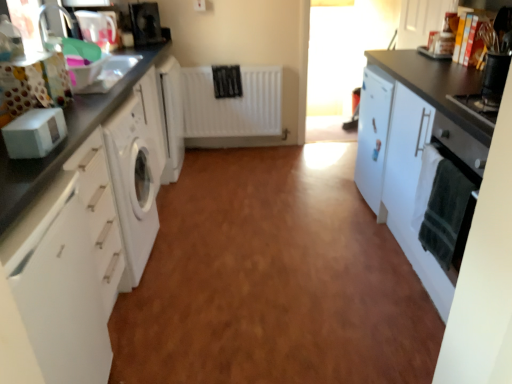
Describe the element at coordinates (59, 287) in the screenshot. This screenshot has height=384, width=512. I see `white matte cabinet at left, the 2th cabinetry from the right` at that location.

Locate an element on the screen. white glossy cabinet at left, positioned as the 1th cabinetry in left-to-right order is located at coordinates (57, 163).

Measure the distance between green towel at right and camera.

The distance of green towel at right from camera is 4.44 feet.

This screenshot has height=384, width=512. In order to click on white glossy jug at upper left, which is the 4th appliance in right-to-left order in this screenshot , I will do `click(97, 28)`.

How much space does white matte cabinet at right, which ranks as the first cabinetry in right-to-left order, occupy horizontally?

The width of white matte cabinet at right, which ranks as the first cabinetry in right-to-left order, is 64.74 centimeters.

This screenshot has height=384, width=512. Describe the element at coordinates (415, 145) in the screenshot. I see `white matte cabinet at right, which ranks as the first cabinetry in right-to-left order` at that location.

What do you see at coordinates (232, 104) in the screenshot?
I see `white matte radiator at center` at bounding box center [232, 104].

Find the location of a particular element. The image size is (512, 384). white matte radiator at center is located at coordinates (232, 104).

The image size is (512, 384). What are the coordinates of `white matte cabinet at left, the 2th cabinetry from the right` in the screenshot? It's located at (59, 287).

From the image's perspective, is white glossy cabinet at left, positioned as the 1th cabinetry in left-to-right order, beneath white matte cabinet at right, marked as the third cabinetry in a left-to-right arrangement?

Correct, white glossy cabinet at left, positioned as the 1th cabinetry in left-to-right order, appears lower than white matte cabinet at right, marked as the third cabinetry in a left-to-right arrangement, in the image.

Which of these two, white glossy cabinet at left, the third cabinetry positioned from the right, or white matte cabinet at right, which ranks as the first cabinetry in right-to-left order, stands shorter?

Standing shorter between the two is white glossy cabinet at left, the third cabinetry positioned from the right.

From a real-world perspective, does white glossy cabinet at left, positioned as the 1th cabinetry in left-to-right order, sit lower than white matte cabinet at right, which ranks as the first cabinetry in right-to-left order?

Actually, white glossy cabinet at left, positioned as the 1th cabinetry in left-to-right order, is physically above white matte cabinet at right, which ranks as the first cabinetry in right-to-left order, in the real world.

Would you say white glossy cabinet at left, positioned as the 1th cabinetry in left-to-right order, is inside or outside white matte cabinet at right, which ranks as the first cabinetry in right-to-left order?

The correct answer is: outside.

Would you say white matte radiator at center contains white glossy washing machine at left?

Actually, white glossy washing machine at left is outside white matte radiator at center.

Based on their positions, is white matte radiator at center located to the left or right of white glossy washing machine at left?

Clearly, white matte radiator at center is on the left of white glossy washing machine at left in the image.

From the image's perspective, would you say white matte radiator at center is positioned over white glossy washing machine at left?

Indeed, from the image's perspective, white matte radiator at center is shown above white glossy washing machine at left.

Considering the relative sizes of white matte radiator at center and white glossy washing machine at left in the image provided, is white matte radiator at center bigger than white glossy washing machine at left?

Actually, white matte radiator at center might be smaller than white glossy washing machine at left.

Considering the positions of point (505, 69) and point (430, 114), is point (505, 69) closer or farther from the camera than point (430, 114)?

Point (505, 69).

From the image's perspective, would you say black plastic container at upper right, acting as the third appliance starting from the back, is positioned over white matte cabinet at right, marked as the third cabinetry in a left-to-right arrangement?

Indeed, from the image's perspective, black plastic container at upper right, acting as the third appliance starting from the back, is shown above white matte cabinet at right, marked as the third cabinetry in a left-to-right arrangement.

Is black plastic container at upper right, acting as the third appliance starting from the back, located outside white matte cabinet at right, which ranks as the first cabinetry in right-to-left order?

Absolutely, black plastic container at upper right, acting as the third appliance starting from the back, is external to white matte cabinet at right, which ranks as the first cabinetry in right-to-left order.

Is black plastic container at upper right, positioned as the 1th appliance in right-to-left order, to the left or to the right of white matte cabinet at right, marked as the third cabinetry in a left-to-right arrangement, in the image?

black plastic container at upper right, positioned as the 1th appliance in right-to-left order, is positioned on white matte cabinet at right, marked as the third cabinetry in a left-to-right arrangement,'s right side.

From the image's perspective, between white matte microwave at left, marked as the 4th appliance in a top-to-bottom arrangement, and white glossy jug at upper left, which appears as the 2th appliance when viewed from the top, which one is located above?

white glossy jug at upper left, which appears as the 2th appliance when viewed from the top, from the image's perspective.

Does point (27, 148) lie behind point (94, 34)?

No.

Is white matte microwave at left, the 3th appliance positioned from the left, completely or partially outside of white glossy jug at upper left, the second appliance in the back-to-front sequence?

That's correct, white matte microwave at left, the 3th appliance positioned from the left, is outside of white glossy jug at upper left, the second appliance in the back-to-front sequence.

Is there a large distance between white matte microwave at left, marked as the 4th appliance in a top-to-bottom arrangement, and white glossy jug at upper left, the second appliance in the back-to-front sequence?

Yes, white matte microwave at left, marked as the 4th appliance in a top-to-bottom arrangement, and white glossy jug at upper left, the second appliance in the back-to-front sequence, are quite far apart.

Measure the distance from white matte radiator at center to black plastic container at upper right, positioned as the 1th appliance in right-to-left order.

white matte radiator at center and black plastic container at upper right, positioned as the 1th appliance in right-to-left order, are 6.83 feet apart.

Is white matte radiator at center in front of or behind black plastic container at upper right, the 3th appliance from the top, in the image?

Visually, white matte radiator at center is located behind black plastic container at upper right, the 3th appliance from the top.

Who is bigger, white matte radiator at center or black plastic container at upper right, which appears as the 4th appliance when viewed from the left?

white matte radiator at center is bigger.

Consider the image. From a real-world perspective, is white matte radiator at center above or below black plastic container at upper right, which appears as the 4th appliance when viewed from the left?

From a real-world perspective, white matte radiator at center is physically below black plastic container at upper right, which appears as the 4th appliance when viewed from the left.

Is white glossy jug at upper left, which is the 4th appliance in right-to-left order, at the left side of black plastic container at upper right, which is counted as the 2th appliance, starting from the front?

Indeed, white glossy jug at upper left, which is the 4th appliance in right-to-left order, is positioned on the left side of black plastic container at upper right, which is counted as the 2th appliance, starting from the front.

Would you say white glossy jug at upper left, the second appliance in the back-to-front sequence, is outside black plastic container at upper right, which is counted as the 2th appliance, starting from the front?

white glossy jug at upper left, the second appliance in the back-to-front sequence, lies outside black plastic container at upper right, which is counted as the 2th appliance, starting from the front,'s area.

Are white glossy jug at upper left, which appears as the 2th appliance when viewed from the top, and black plastic container at upper right, which is counted as the 2th appliance, starting from the front, far apart?

Absolutely, white glossy jug at upper left, which appears as the 2th appliance when viewed from the top, is distant from black plastic container at upper right, which is counted as the 2th appliance, starting from the front.

Which is behind, white matte radiator at center or black glossy fan at upper center, the first appliance positioned from the top?

white matte radiator at center is behind.

Which of these two, white matte radiator at center or black glossy fan at upper center, arranged as the fourth appliance when viewed from the front, stands taller?

white matte radiator at center.

From a real-world perspective, is white matte radiator at center above or below black glossy fan at upper center, placed as the 2th appliance when sorted from left to right?

white matte radiator at center is below black glossy fan at upper center, placed as the 2th appliance when sorted from left to right.

I want to click on the 1st cabinetry positioned below the white matte cabinet at right, which ranks as the first cabinetry in right-to-left order (from the image's perspective), so click(57, 163).

At what (x,y) coordinates should I click in order to perform the action: click on radiator on the left of white glossy washing machine at left. Please return your answer as a coordinate pair (x, y). Looking at the image, I should click on (232, 104).

Considering their positions, is white matte cabinet at left, the 2th cabinetry from the right, positioned closer to white glossy jug at upper left, which appears as the 2th appliance when viewed from the top, than green towel at right?

white matte cabinet at left, the 2th cabinetry from the right, lies closer to white glossy jug at upper left, which appears as the 2th appliance when viewed from the top, than the other object.

Estimate the real-world distances between objects in this image. Which object is closer to white glossy washing machine at left, black glossy fan at upper center, placed as the 2th appliance when sorted from left to right, or white matte cabinet at left, the 2th cabinetry from the right?

The object closer to white glossy washing machine at left is white matte cabinet at left, the 2th cabinetry from the right.

Based on their spatial positions, is white matte radiator at center or white matte cabinet at right, which ranks as the first cabinetry in right-to-left order, further from black glossy fan at upper center, acting as the 1th appliance starting from the back?

white matte cabinet at right, which ranks as the first cabinetry in right-to-left order, is further to black glossy fan at upper center, acting as the 1th appliance starting from the back.

From the image, which object appears to be nearer to white matte radiator at center, green towel at right or white matte microwave at left, the second appliance from the right?

green towel at right is positioned closer to the anchor white matte radiator at center.

Which object lies further to the anchor point white matte radiator at center, white glossy washing machine at left or black glossy fan at upper center, placed as the 2th appliance when sorted from left to right?

Among the two, white glossy washing machine at left is located further to white matte radiator at center.

Which object lies further to the anchor point white glossy jug at upper left, which is the 4th appliance in right-to-left order, white glossy cabinet at left, the third cabinetry positioned from the right, or green towel at right?

green towel at right is further to white glossy jug at upper left, which is the 4th appliance in right-to-left order.

In the scene shown: Estimate the real-world distances between objects in this image. Which object is closer to black plastic container at upper right, which is counted as the 2th appliance, starting from the front, white glossy washing machine at left or white glossy cabinet at left, positioned as the 1th cabinetry in left-to-right order?

Among the two, white glossy washing machine at left is located nearer to black plastic container at upper right, which is counted as the 2th appliance, starting from the front.

In the scene shown: Looking at the image, which one is located closer to white matte radiator at center, white matte microwave at left, the second appliance from the right, or white glossy jug at upper left, which is the 4th appliance in right-to-left order?

white glossy jug at upper left, which is the 4th appliance in right-to-left order, lies closer to white matte radiator at center than the other object.

The image size is (512, 384). Find the location of `plain between white glossy cabinet at left, the third cabinetry positioned from the right, and black glossy fan at upper center, acting as the 1th appliance starting from the back, along the z-axis`. plain between white glossy cabinet at left, the third cabinetry positioned from the right, and black glossy fan at upper center, acting as the 1th appliance starting from the back, along the z-axis is located at coordinates (272, 281).

Identify the location of appliance between white matte cabinet at left, the 2th cabinetry from the right, and white matte cabinet at right, which ranks as the first cabinetry in right-to-left order. This screenshot has width=512, height=384. (35, 133).

This screenshot has width=512, height=384. Find the location of `home appliance between white matte cabinet at left, the 2th cabinetry from the right, and white matte radiator at center, along the z-axis`. home appliance between white matte cabinet at left, the 2th cabinetry from the right, and white matte radiator at center, along the z-axis is located at coordinates (459, 147).

Identify the location of plain between white matte microwave at left, the 1th appliance viewed from the front, and black glossy fan at upper center, which ranks as the fourth appliance in bottom-to-top order, along the z-axis. (272, 281).